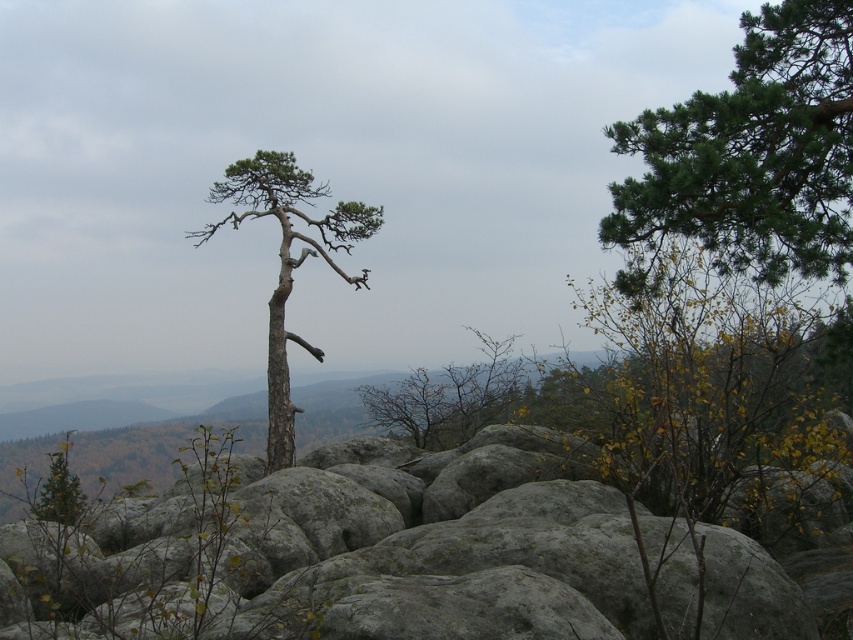
Between green leafy bush at center and green needle-like branches at upper right, which one is positioned lower?

green leafy bush at center is below.

Is green leafy bush at center positioned at the back of green needle-like branches at upper right?

Yes, green leafy bush at center is further from the viewer.

The image size is (853, 640). Identify the location of green leafy bush at center. (704, 396).

Does green leafy bush at center have a greater width compared to gray bark tree at center?

Indeed, green leafy bush at center has a greater width compared to gray bark tree at center.

What do you see at coordinates (704, 396) in the screenshot? I see `green leafy bush at center` at bounding box center [704, 396].

Where is `green leafy bush at center`? green leafy bush at center is located at coordinates (704, 396).

Measure the distance between green needle-like branches at upper right and camera.

A distance of 5.68 meters exists between green needle-like branches at upper right and camera.

Which of these two, green needle-like branches at upper right or gray bark tree at center, stands taller?

gray bark tree at center

Where is `green needle-like branches at upper right`? The width and height of the screenshot is (853, 640). green needle-like branches at upper right is located at coordinates (753, 154).

Locate an element on the screen. The width and height of the screenshot is (853, 640). green needle-like branches at upper right is located at coordinates (753, 154).